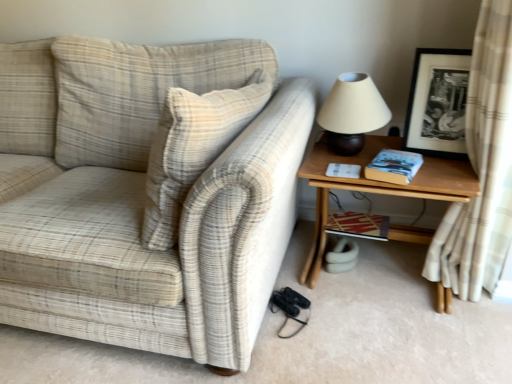
Question: Should I look upward or downward to see hardcover book at right, the first book viewed from the front?

Choices:
 (A) down
 (B) up

Answer: (B)

Question: Is wooden table at right a part of beige plaid fabric couch at left?

Choices:
 (A) no
 (B) yes

Answer: (A)

Question: Does beige plaid fabric couch at left have a greater height compared to wooden table at right?

Choices:
 (A) no
 (B) yes

Answer: (B)

Question: Is beige plaid fabric couch at left thinner than wooden table at right?

Choices:
 (A) yes
 (B) no

Answer: (B)

Question: From a real-world perspective, is beige plaid fabric couch at left over wooden table at right?

Choices:
 (A) yes
 (B) no

Answer: (A)

Question: Is beige plaid fabric couch at left oriented towards wooden table at right?

Choices:
 (A) no
 (B) yes

Answer: (A)

Question: Is beige plaid fabric couch at left smaller than wooden table at right?

Choices:
 (A) no
 (B) yes

Answer: (A)

Question: From a real-world perspective, does matte beige lampshade at upper right sit lower than striped paper book at lower right, which ranks as the first book in back-to-front order?

Choices:
 (A) yes
 (B) no

Answer: (B)

Question: Is striped paper book at lower right, which is counted as the first book, starting from the bottom, a part of matte beige lampshade at upper right?

Choices:
 (A) no
 (B) yes

Answer: (A)

Question: Is matte beige lampshade at upper right turned away from striped paper book at lower right, which is counted as the first book, starting from the bottom?

Choices:
 (A) no
 (B) yes

Answer: (A)

Question: Is the surface of matte beige lampshade at upper right in direct contact with striped paper book at lower right, which is counted as the 2th book, starting from the front?

Choices:
 (A) no
 (B) yes

Answer: (A)

Question: Considering the relative positions of matte beige lampshade at upper right and striped paper book at lower right, which is counted as the 2th book, starting from the front, in the image provided, is matte beige lampshade at upper right to the left of striped paper book at lower right, which is counted as the 2th book, starting from the front, from the viewer's perspective?

Choices:
 (A) no
 (B) yes

Answer: (B)

Question: From a real-world perspective, does matte beige lampshade at upper right stand above striped paper book at lower right, which is counted as the first book, starting from the bottom?

Choices:
 (A) no
 (B) yes

Answer: (B)

Question: Does striped paper book at lower right, which is counted as the 2th book, starting from the front, have a larger size compared to beige plaid fabric couch at left?

Choices:
 (A) yes
 (B) no

Answer: (B)